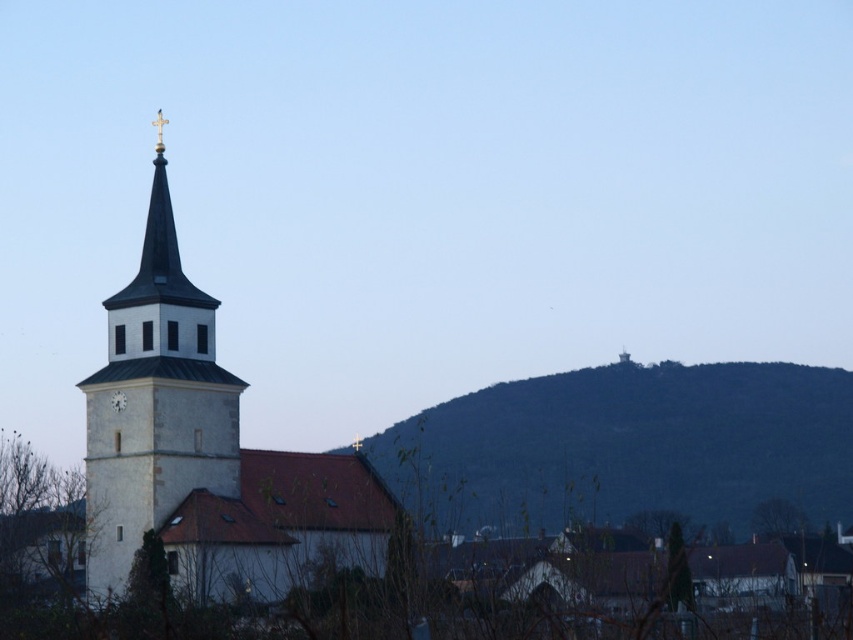
Question: Can you confirm if white stone bell tower at left is smaller than white matte clock at center-left?

Choices:
 (A) yes
 (B) no

Answer: (B)

Question: Is green textured hill at center below white matte clock at center-left?

Choices:
 (A) yes
 (B) no

Answer: (A)

Question: Which is nearer to the white stone bell tower at left?

Choices:
 (A) white matte clock at center-left
 (B) green textured hill at center

Answer: (A)

Question: Which of the following is the farthest from the observer?

Choices:
 (A) (125, 396)
 (B) (119, 497)

Answer: (A)

Question: Among these objects, which one is nearest to the camera?

Choices:
 (A) white stone bell tower at left
 (B) white matte clock at center-left

Answer: (A)

Question: Is green textured hill at center to the right of white stone bell tower at left from the viewer's perspective?

Choices:
 (A) yes
 (B) no

Answer: (A)